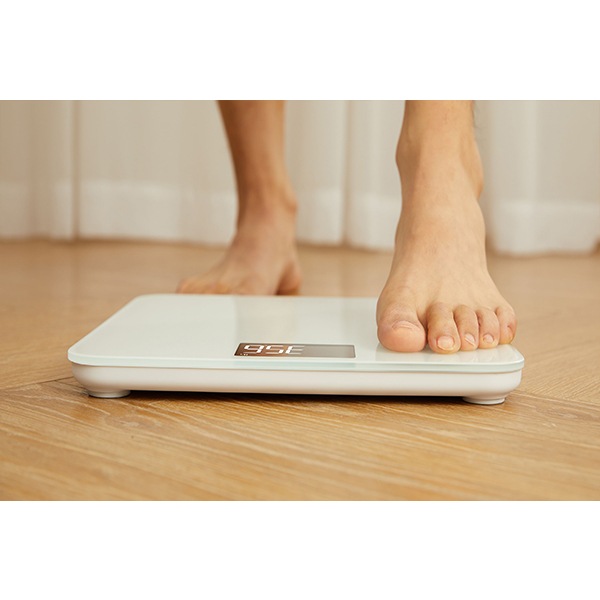
Locate an element on the screen. The height and width of the screenshot is (600, 600). digital scale display is located at coordinates (307, 349).